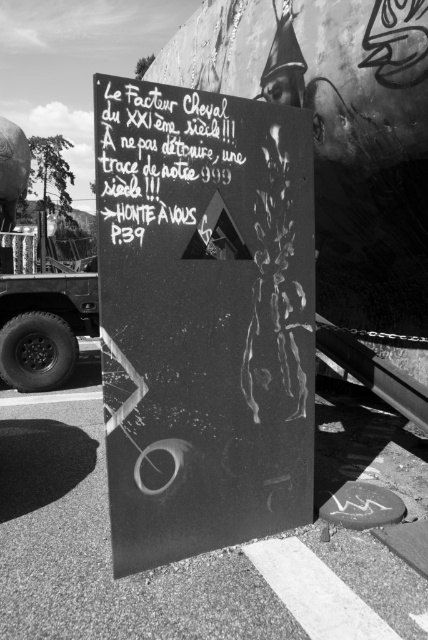
You are a delivery driver who needs to read the message on the black matte sign at center. The metallic truck tire at left is blocking your view. Can you move the tire to see the sign better?

The black matte sign at center is below the metallic truck tire at left, so moving the tire might allow you to see the sign better.

You are standing in front of the black chalkboard sign at upper center and want to touch the metallic truck tire at left. Which direction should you move to reach it?

You should move to your left because the metallic truck tire at left is positioned to the left side of the black chalkboard sign at upper center.

You are an artist standing at point (165, 166). You want to draw the black chalkboard sign at upper center. Is the point you are standing at the same as the location of the black chalkboard sign at upper center?

Yes, the point (165, 166) is where the black chalkboard sign at upper center is located.